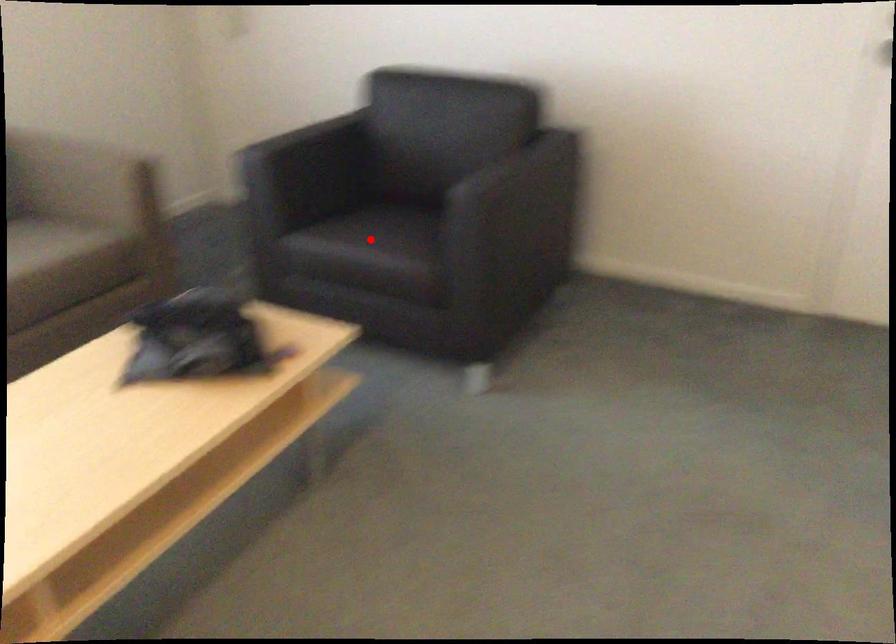
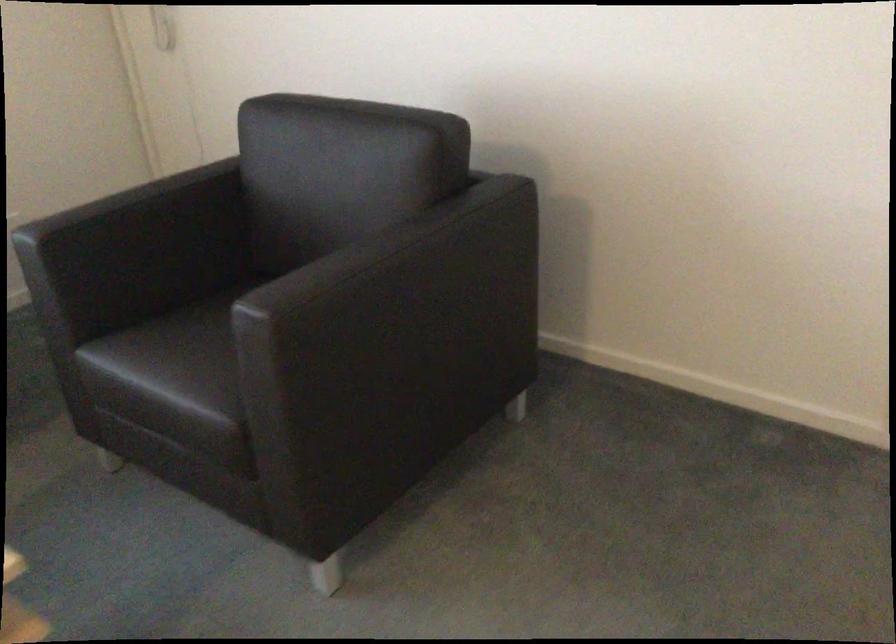
Question: I am providing you with two images of the same scene from different viewpoints. Given a red point in image1, look at the same physical point in image2. Is it:

Choices:
 (A) Closer to the viewpoint
 (B) Farther from the viewpoint

Answer: (A)